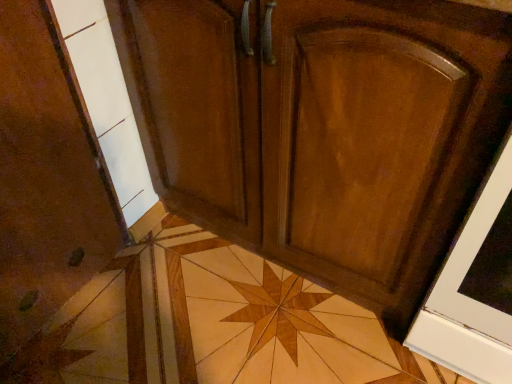
Identify the location of matte white screen door at right. The width and height of the screenshot is (512, 384). (475, 288).

What do you see at coordinates (475, 288) in the screenshot?
I see `matte white screen door at right` at bounding box center [475, 288].

At what (x,y) coordinates should I click in order to perform the action: click on matte white screen door at right. Please return your answer as a coordinate pair (x, y). The image size is (512, 384). Looking at the image, I should click on (475, 288).